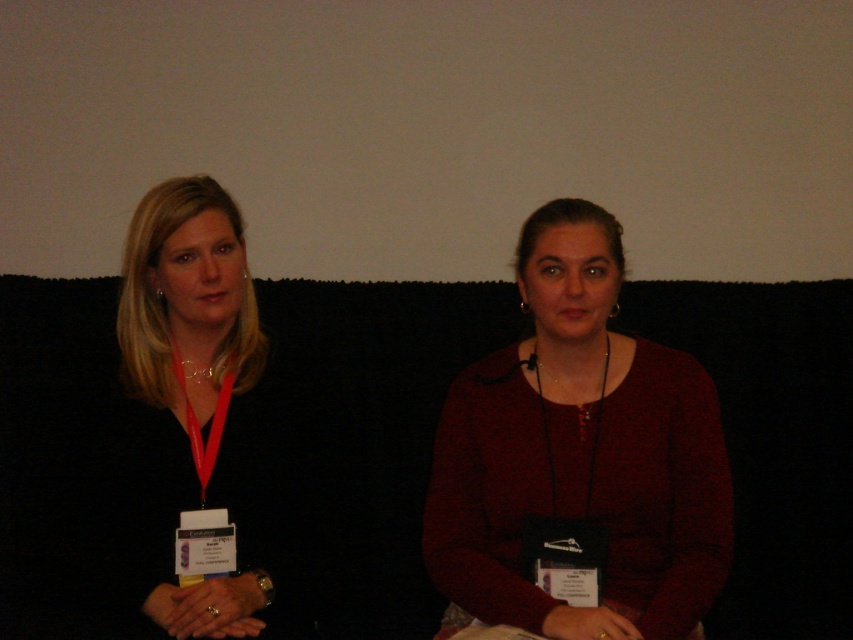
You are an event organizer who needs to identify participants based on their clothing and accessories. You see the matte red sweater at center and the black matte lanyard at left. Which object is located lower in the image?

The matte red sweater at center is positioned under the black matte lanyard at left, so the matte red sweater at center is lower.

You are a photographer setting up for a group photo. You notice two points marked in the scene. The first point is at coordinate point (x=579, y=262) and the second is at coordinate point (x=169, y=209). Which of these two points is closer to the camera?

Point (x=579, y=262) is in front of point (x=169, y=209), so it is closer to the camera.